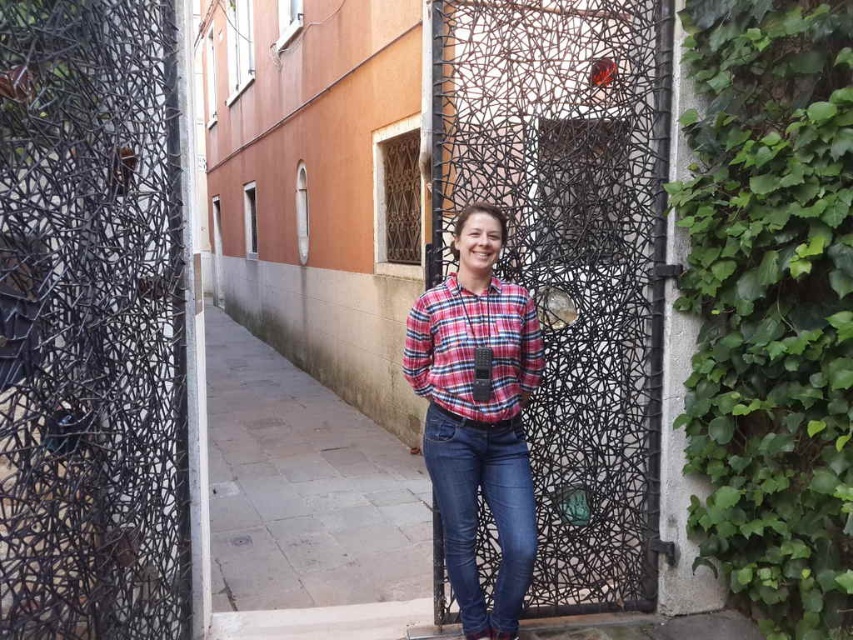
Does black wire mesh at center come in front of black textured door at center?

Yes, it is in front of black textured door at center.

This screenshot has width=853, height=640. What are the coordinates of `black wire mesh at center` in the screenshot? It's located at (91, 323).

This screenshot has width=853, height=640. Find the location of `gray concrete pavement at center`. gray concrete pavement at center is located at coordinates (305, 486).

Does gray concrete pavement at center have a lesser width compared to plaid cotton shirt at center?

Yes, gray concrete pavement at center is thinner than plaid cotton shirt at center.

Locate an element on the screen. Image resolution: width=853 pixels, height=640 pixels. gray concrete pavement at center is located at coordinates pyautogui.click(x=305, y=486).

Which is more to the left, black wire mesh at center or gray concrete pavement at center?

From the viewer's perspective, gray concrete pavement at center appears more on the left side.

Which of these two, black wire mesh at center or gray concrete pavement at center, stands shorter?

gray concrete pavement at center

Is point (155, 387) positioned in front of point (277, 378)?

That is True.

At what (x,y) coordinates should I click in order to perform the action: click on black wire mesh at center. Please return your answer as a coordinate pair (x, y). This screenshot has height=640, width=853. Looking at the image, I should click on (91, 323).